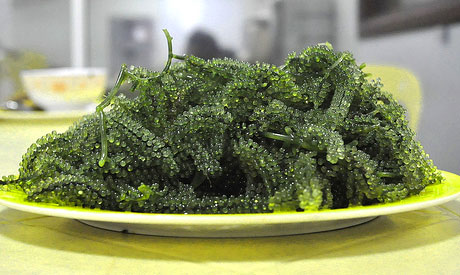
I want to click on something hanging from wall, so click(x=397, y=9).